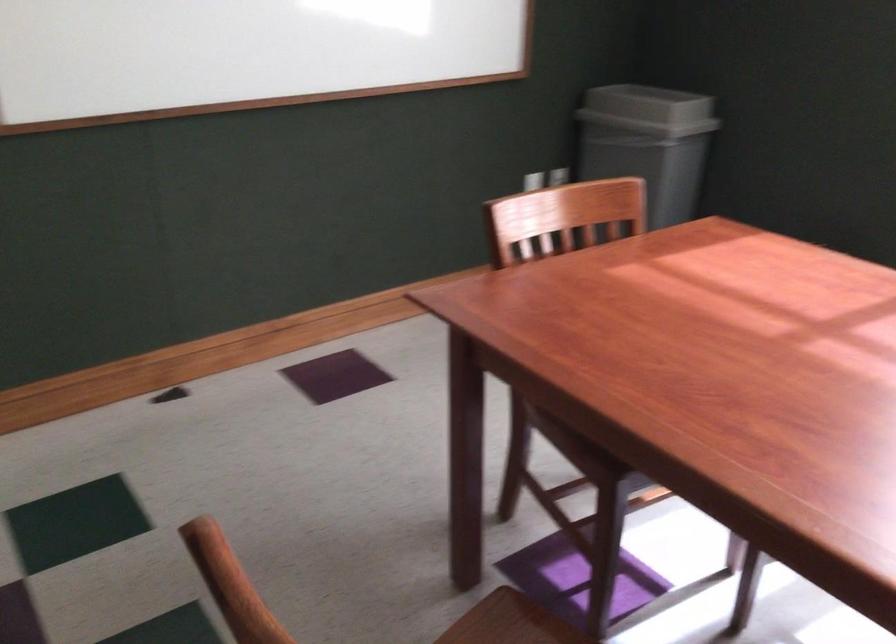
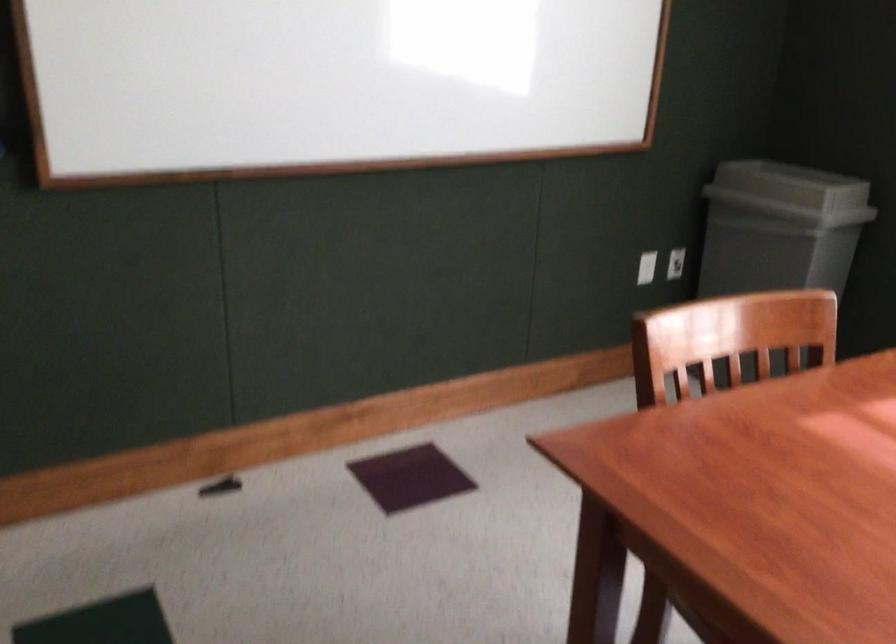
Locate, in the second image, the point that corresponds to [640,106] in the first image.

(791, 185)